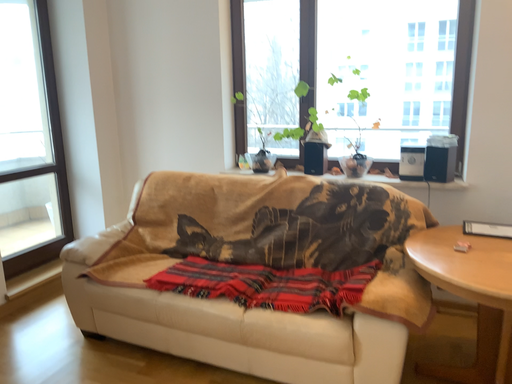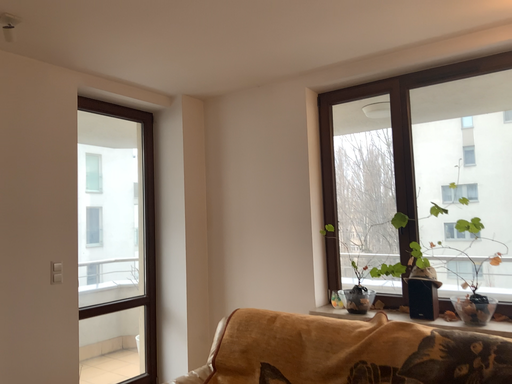
Question: Which way did the camera rotate in the video?

Choices:
 (A) rotated right
 (B) rotated left

Answer: (B)